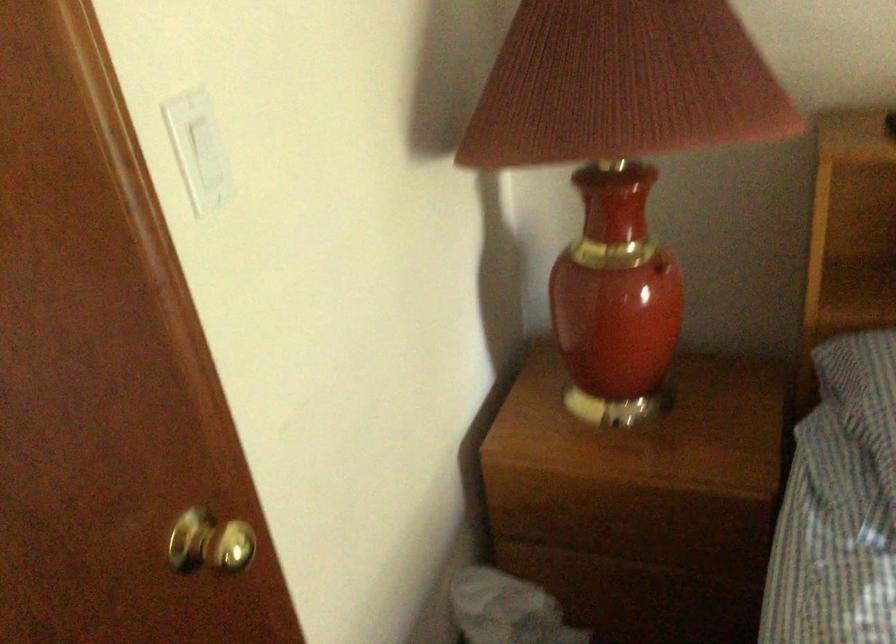
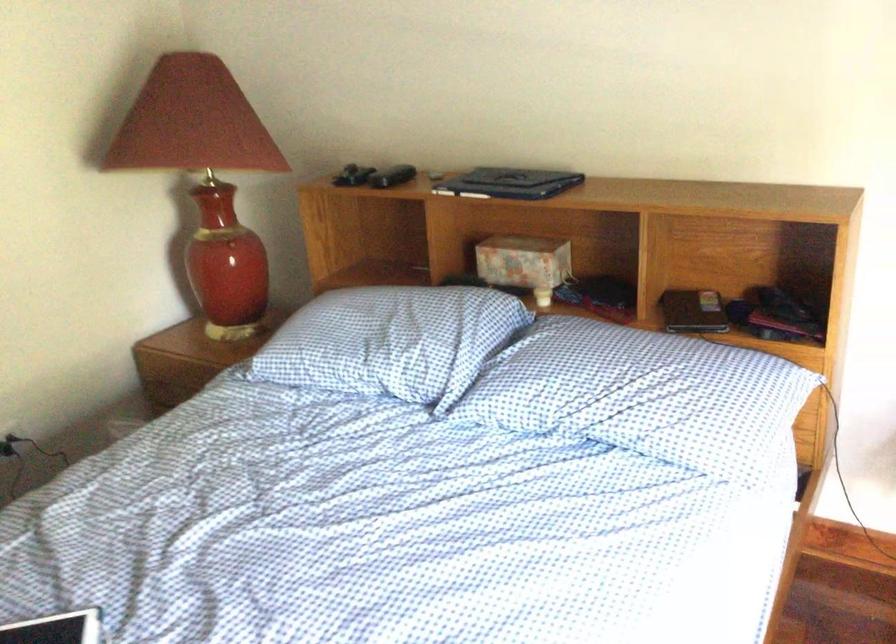
Which direction would the cameraman need to move to produce the second image?

The movement direction of the cameraman is right, backward.